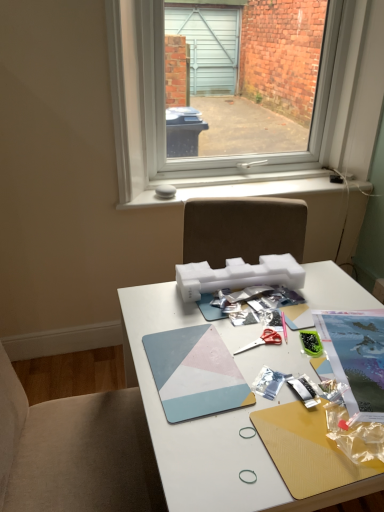
In order to click on free space in front of geometric matte mousepad at center, positioned as the first magazine in left-to-right order in this screenshot , I will do `click(208, 452)`.